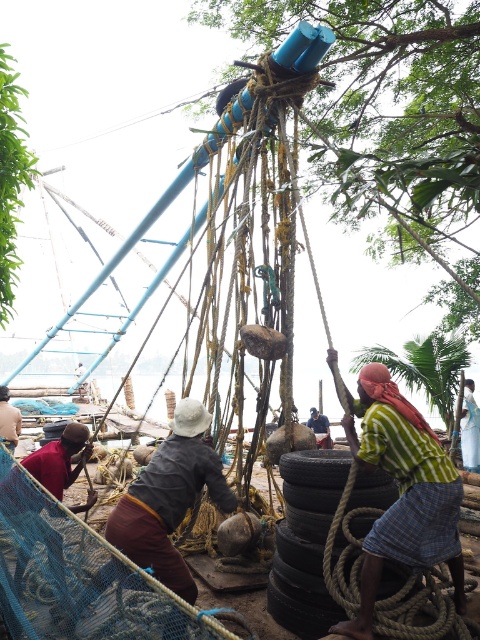
You are standing at the camera position and want to pick up the red fabric at lower left. Is it within your immediate reach?

The red fabric at lower left is 3.53 meters from the camera, so it is not within immediate reach.

You are a safety inspector in the boat maintenance area. You notice two fabrics in the scene, the red fabric at lower left and the striped fabric shirt at lower right. Which fabric is covering the other?

The red fabric at lower left is positioned over striped fabric shirt at lower right, so the red fabric is covering the striped fabric shirt.

You are a safety inspector checking the distance between the red fabric at lower left and the dark gray fabric at lower left. The safety regulation requires a minimum of 3 meters between flammable materials. Does this setup comply with the regulation?

The distance between the red fabric at lower left and the dark gray fabric at lower left is 3.31 meters, which exceeds the 3 meters requirement. Therefore, this setup complies with the safety regulation.